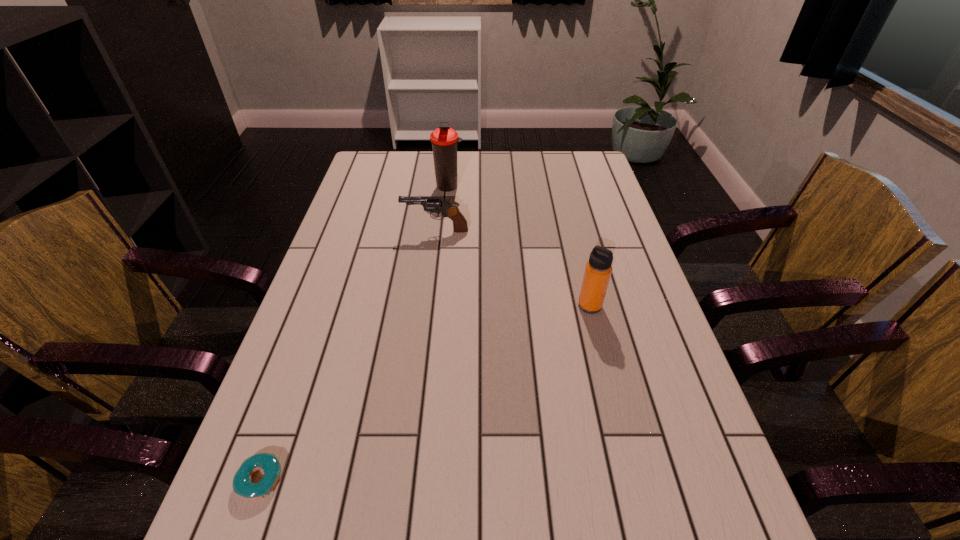
Identify the location of free spot that satisfies the following two spatial constraints: 1. on the front side of the tallest object; 2. on the left side of the second nearest object. (437, 306).

I want to click on free spot that satisfies the following two spatial constraints: 1. on the front side of the third farthest object; 2. on the right side of the taller thermos bottle, so click(437, 306).

You are a GUI agent. You are given a task and a screenshot of the screen. Output one action in this format:
    pyautogui.click(x=<x>, y=<y>)
    Task: Click on the free point that satisfies the following two spatial constraints: 1. along the barrel of the second shortest object; 2. on the left side of the farther thermos bottle
    The width and height of the screenshot is (960, 540).
    Given the screenshot: What is the action you would take?
    pyautogui.click(x=441, y=186)

Locate an element on the screen. The height and width of the screenshot is (540, 960). free location that satisfies the following two spatial constraints: 1. along the barrel of the second shortest object; 2. on the back side of the tallest object is located at coordinates (441, 186).